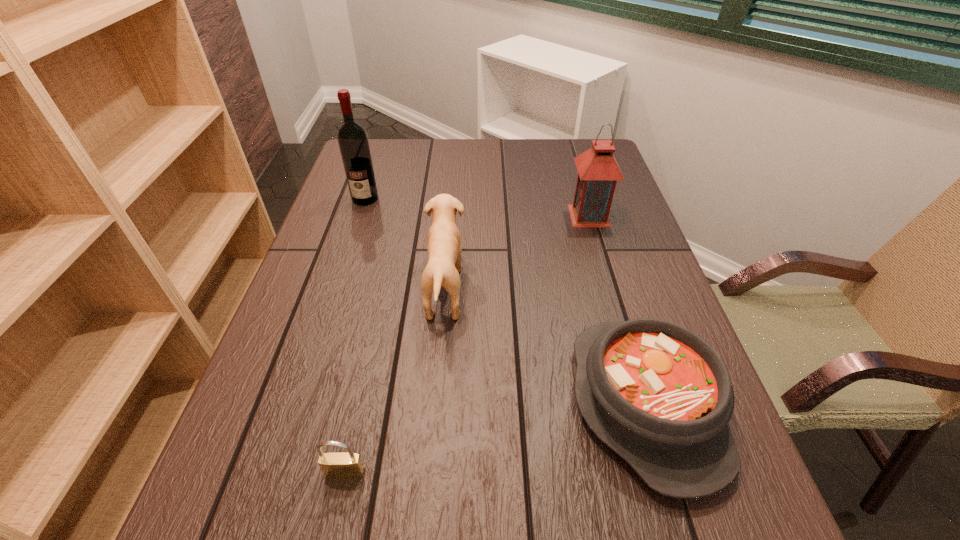
Where is `the leftmost object`? The height and width of the screenshot is (540, 960). the leftmost object is located at coordinates (x=352, y=138).

Locate an element on the screen. This screenshot has height=540, width=960. the fourth shortest object is located at coordinates (598, 171).

The width and height of the screenshot is (960, 540). Find the location of `the third object from right to left`. the third object from right to left is located at coordinates (444, 247).

The width and height of the screenshot is (960, 540). I want to click on the third tallest object, so click(444, 247).

This screenshot has width=960, height=540. I want to click on casserole, so click(x=657, y=394).

You are a GUI agent. You are given a task and a screenshot of the screen. Output one action in this format:
    pyautogui.click(x=<x>, y=<y>)
    Task: Click on the padlock
    
    Given the screenshot: What is the action you would take?
    pyautogui.click(x=339, y=465)

This screenshot has width=960, height=540. I want to click on free space located on the front and back of the leftmost object, so click(x=345, y=261).

Find the location of a particular element. vacant area located on the front of the second tallest object is located at coordinates (608, 278).

Where is `free location located on the left side of the puppy`? free location located on the left side of the puppy is located at coordinates (562, 289).

Find the location of a particular element. free spot located on the left of the casserole is located at coordinates point(372,404).